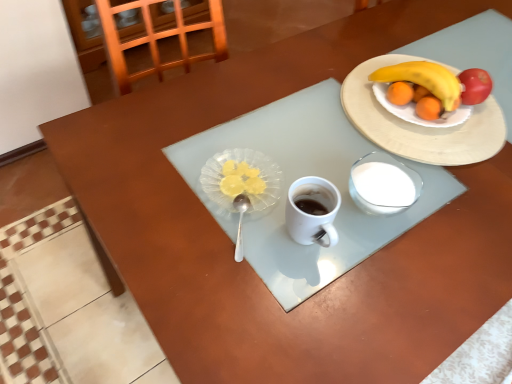
This screenshot has height=384, width=512. Identify the location of vacant space situated on the left part of yellow matte banana at upper right. (332, 96).